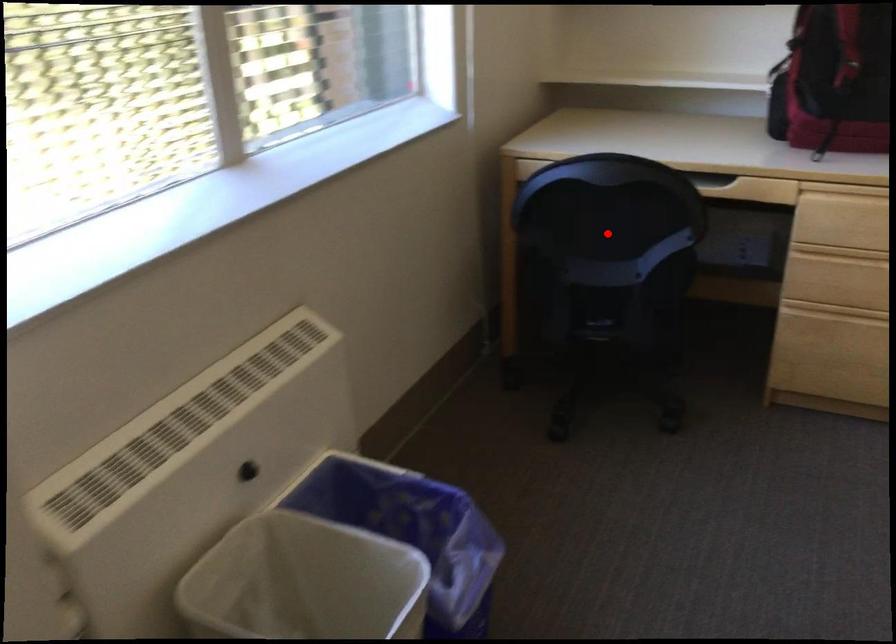
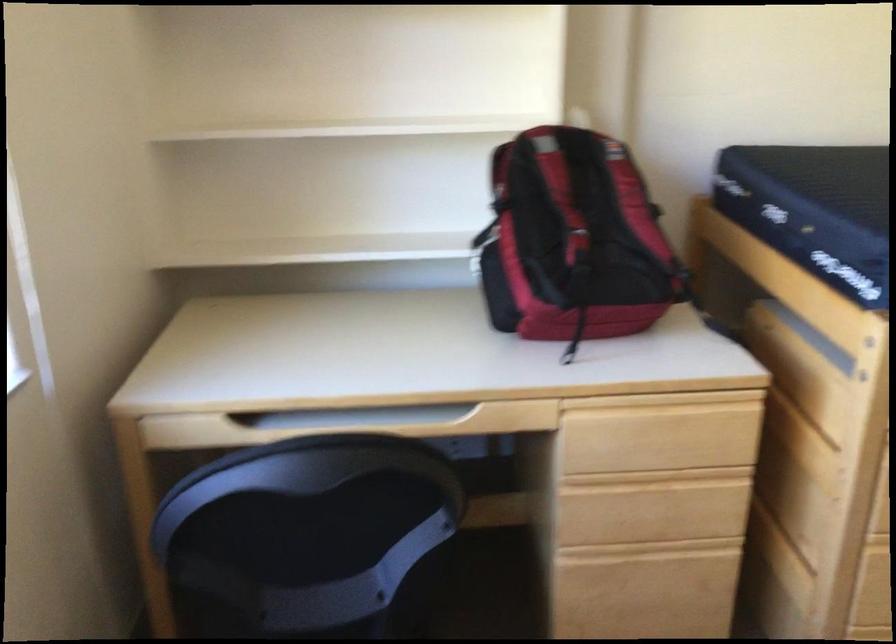
Find the pixel in the second image that matches the highlighted location in the first image.

(317, 544)